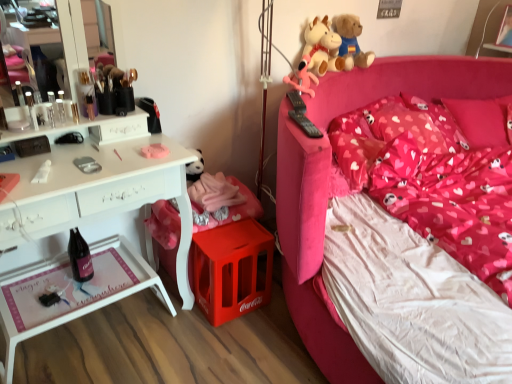
Question: Does soft plush cow at upper right, which is the 2th toy from back to front, have a larger size compared to white plastic tray at left?

Choices:
 (A) yes
 (B) no

Answer: (B)

Question: From the image's perspective, is soft plush cow at upper right, which is the 2th toy from back to front, under white plastic tray at left?

Choices:
 (A) yes
 (B) no

Answer: (B)

Question: Is soft plush cow at upper right, which ranks as the 2th toy in front-to-back order, with white plastic tray at left?

Choices:
 (A) no
 (B) yes

Answer: (A)

Question: Considering the relative positions of soft plush cow at upper right, which ranks as the 2th toy in front-to-back order, and white plastic tray at left in the image provided, is soft plush cow at upper right, which ranks as the 2th toy in front-to-back order, to the left of white plastic tray at left from the viewer's perspective?

Choices:
 (A) yes
 (B) no

Answer: (B)

Question: Is the depth of soft plush cow at upper right, which ranks as the 2th toy in front-to-back order, less than that of white plastic tray at left?

Choices:
 (A) no
 (B) yes

Answer: (A)

Question: From the image's perspective, would you say matte pink plush at upper right, which is counted as the 3th toy, starting from the back, is positioned over pink fabric bed at right?

Choices:
 (A) no
 (B) yes

Answer: (B)

Question: From the image's perspective, would you say matte pink plush at upper right, which is counted as the 3th toy, starting from the back, is shown under pink fabric bed at right?

Choices:
 (A) no
 (B) yes

Answer: (A)

Question: Considering the relative sizes of matte pink plush at upper right, which appears as the first toy when viewed from the front, and pink fabric bed at right in the image provided, is matte pink plush at upper right, which appears as the first toy when viewed from the front, smaller than pink fabric bed at right?

Choices:
 (A) no
 (B) yes

Answer: (B)

Question: Can you confirm if matte pink plush at upper right, which appears as the first toy when viewed from the front, is bigger than pink fabric bed at right?

Choices:
 (A) no
 (B) yes

Answer: (A)

Question: Is the position of matte pink plush at upper right, which appears as the first toy when viewed from the front, less distant than that of pink fabric bed at right?

Choices:
 (A) yes
 (B) no

Answer: (B)

Question: Is matte pink plush at upper right, which is counted as the 3th toy, starting from the back, placed right next to pink fabric bed at right?

Choices:
 (A) yes
 (B) no

Answer: (B)

Question: Considering the relative sizes of black glass bottle at lower left and matte pink plush at upper right, which is counted as the 3th toy, starting from the back, in the image provided, is black glass bottle at lower left bigger than matte pink plush at upper right, which is counted as the 3th toy, starting from the back,?

Choices:
 (A) yes
 (B) no

Answer: (B)